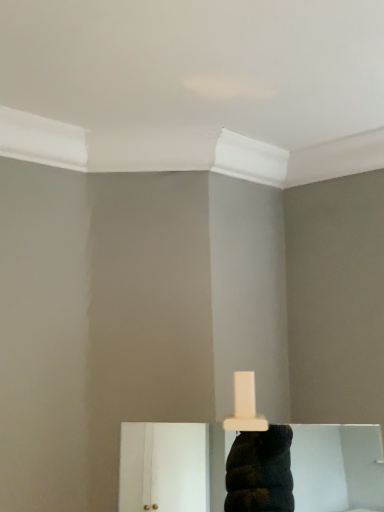
Image resolution: width=384 pixels, height=512 pixels. I want to click on white matte towel rack at center, so click(x=166, y=466).

Measure the distance between point (126,449) and camera.

A distance of 1.12 meters exists between point (126,449) and camera.

What is the approximate height of white matte towel rack at center?

It is 14.08 inches.

Consider the image. Measure the distance between white matte towel rack at center and camera.

A distance of 6.81 feet exists between white matte towel rack at center and camera.

Image resolution: width=384 pixels, height=512 pixels. Describe the element at coordinates (166, 466) in the screenshot. I see `white matte towel rack at center` at that location.

Find the location of a particular element. This screenshot has width=384, height=512. white matte towel rack at center is located at coordinates (166, 466).